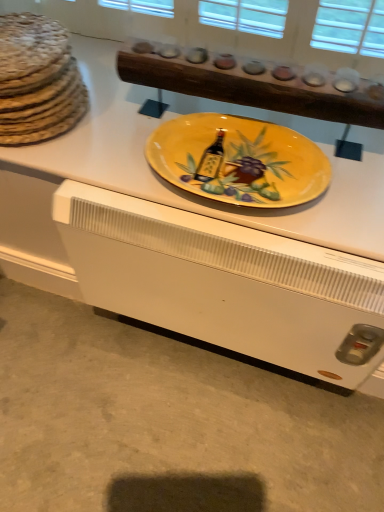
Question: Can you confirm if brown textured bread at left is smaller than yellow glossy plate at center?

Choices:
 (A) no
 (B) yes

Answer: (A)

Question: Is brown textured bread at left in front of yellow glossy plate at center?

Choices:
 (A) no
 (B) yes

Answer: (A)

Question: Considering the relative sizes of brown textured bread at left and yellow glossy plate at center in the image provided, is brown textured bread at left shorter than yellow glossy plate at center?

Choices:
 (A) yes
 (B) no

Answer: (B)

Question: Are brown textured bread at left and yellow glossy plate at center located far from each other?

Choices:
 (A) yes
 (B) no

Answer: (B)

Question: From the image's perspective, is brown textured bread at left beneath yellow glossy plate at center?

Choices:
 (A) no
 (B) yes

Answer: (A)

Question: Based on their positions, is yellow ceramic plate at center located to the left or right of white matte heater at lower center?

Choices:
 (A) left
 (B) right

Answer: (B)

Question: Does point [x=213, y=157] appear closer or farther from the camera than point [x=18, y=308]?

Choices:
 (A) closer
 (B) farther

Answer: (A)

Question: In terms of width, does yellow ceramic plate at center look wider or thinner when compared to white matte heater at lower center?

Choices:
 (A) wide
 (B) thin

Answer: (B)

Question: Relative to white matte heater at lower center, is yellow ceramic plate at center in front or behind?

Choices:
 (A) behind
 (B) front

Answer: (B)

Question: Considering the positions of yellow glossy plate at center and yellow ceramic plate at center in the image, is yellow glossy plate at center taller or shorter than yellow ceramic plate at center?

Choices:
 (A) tall
 (B) short

Answer: (B)

Question: In the image, is yellow glossy plate at center on the left side or the right side of yellow ceramic plate at center?

Choices:
 (A) left
 (B) right

Answer: (A)

Question: Choose the correct answer: Is yellow glossy plate at center inside yellow ceramic plate at center or outside it?

Choices:
 (A) outside
 (B) inside

Answer: (A)

Question: Considering their positions, is yellow glossy plate at center located in front of or behind yellow ceramic plate at center?

Choices:
 (A) front
 (B) behind

Answer: (B)

Question: In the image, is brown textured bread at left positioned in front of or behind white matte heater at lower center?

Choices:
 (A) front
 (B) behind

Answer: (A)

Question: Considering the positions of point (3, 29) and point (129, 320), is point (3, 29) closer or farther from the camera than point (129, 320)?

Choices:
 (A) farther
 (B) closer

Answer: (B)